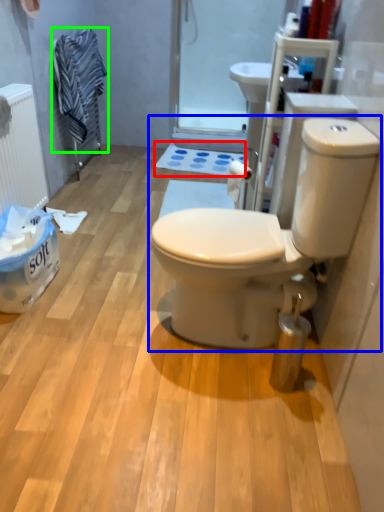
Question: Based on their relative distances, which object is nearer to bath mat (highlighted by a red box)? Choose from toilet (highlighted by a blue box) and laundry (highlighted by a green box).

Choices:
 (A) toilet
 (B) laundry

Answer: (B)